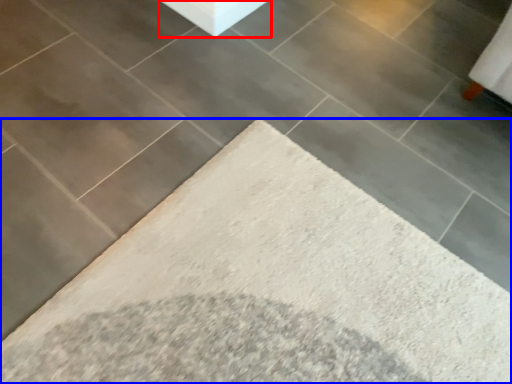
Question: Which point is further to the camera, concrete (highlighted by a red box) or furniture (highlighted by a blue box)?

Choices:
 (A) concrete
 (B) furniture

Answer: (A)